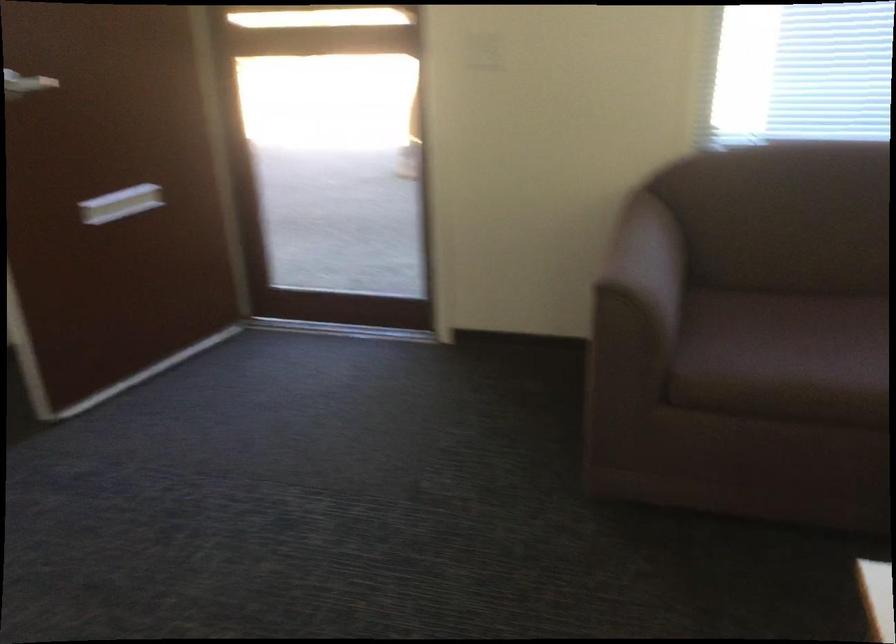
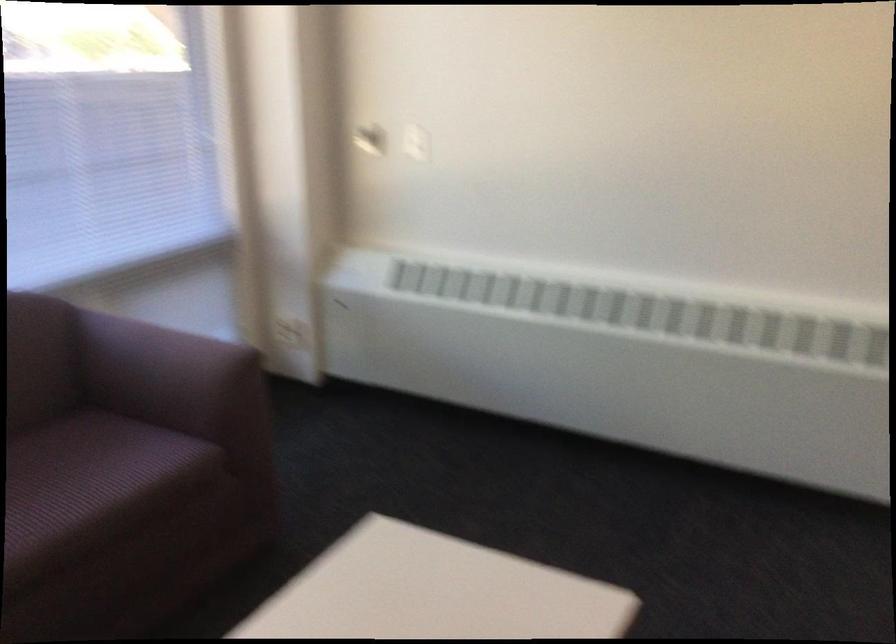
Question: The camera is either moving clockwise (left) or counter-clockwise (right) around the object. The first image is from the beginning of the video and the second image is from the end. Is the camera moving left or right when shooting the video?

Choices:
 (A) Left
 (B) Right

Answer: (A)